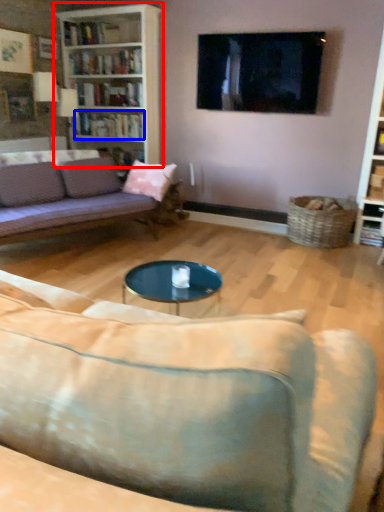
Question: Which of the following is the closest to the observer, bookcase (highlighted by a red box) or book (highlighted by a blue box)?

Choices:
 (A) bookcase
 (B) book

Answer: (A)